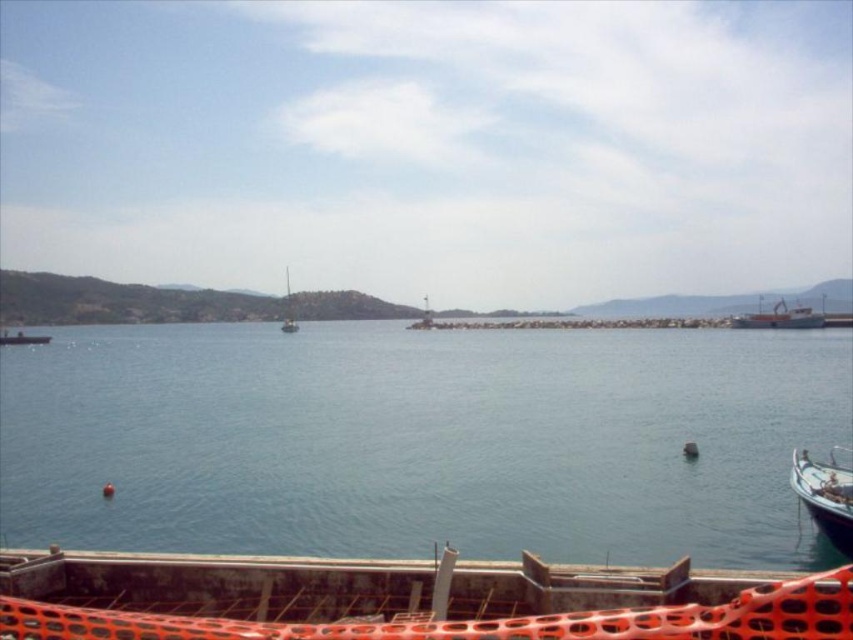
You are a photographer planning to capture both the white wooden boat at lower right and the white sailboat at center in a single frame. Given their sizes in the image, which boat should you focus on to ensure both fit comfortably in the photo without overcrowding?

The white wooden boat at lower right occupies less space than the white sailboat at center. To ensure both fit comfortably, focus on the white wooden boat at lower right first since it takes up less area, allowing more room for the larger white sailboat at center in the frame.

You are standing on the dock and want to see the white wooden boat at lower right. Is the blue water at center blocking your view of it?

The blue water at center is in front of the white wooden boat at lower right, so it would block your view of the boat.

You are standing on the dock with the red safety netting barrier and want to reach the white wooden boat at lower right. Which direction should you walk to get there?

The white wooden boat at lower right is located at point [825,497], so you should walk towards the lower right direction to reach it.